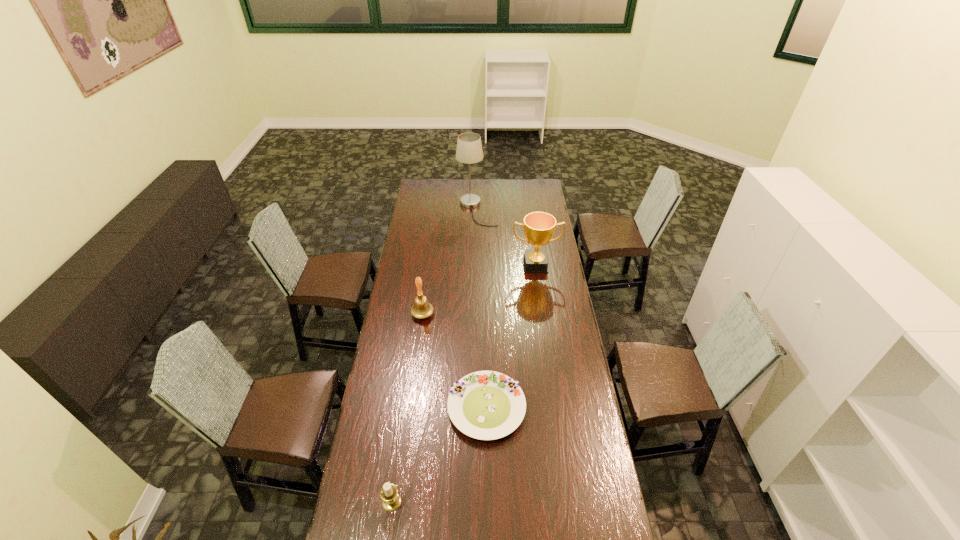
The width and height of the screenshot is (960, 540). I want to click on free location located 0.300m on the front of the tallest object, so click(x=477, y=259).

I want to click on free space located 0.080m on the front-facing side of the fourth shortest object, so click(539, 286).

At what (x,y) coordinates should I click in order to perform the action: click on vacant space situated 0.380m on the front of the third shortest object. Please return your answer as a coordinate pair (x, y). Image resolution: width=960 pixels, height=540 pixels. Looking at the image, I should click on pyautogui.click(x=412, y=393).

Identify the location of free space located 0.060m on the right of the nearest object. Image resolution: width=960 pixels, height=540 pixels. (420, 502).

I want to click on free region located on the left of the fourth farthest object, so click(435, 408).

The height and width of the screenshot is (540, 960). What are the coordinates of `object located at the far edge` in the screenshot? It's located at (469, 150).

Locate an element on the screen. The width and height of the screenshot is (960, 540). bell located in the left edge section of the desktop is located at coordinates (421, 309).

Identify the location of candle holder located in the left edge section of the desktop. (389, 494).

This screenshot has height=540, width=960. I want to click on object that is at the right edge, so click(x=539, y=227).

In the image, there is a desktop. Where is `free region at the far edge`? Image resolution: width=960 pixels, height=540 pixels. free region at the far edge is located at coordinates (485, 193).